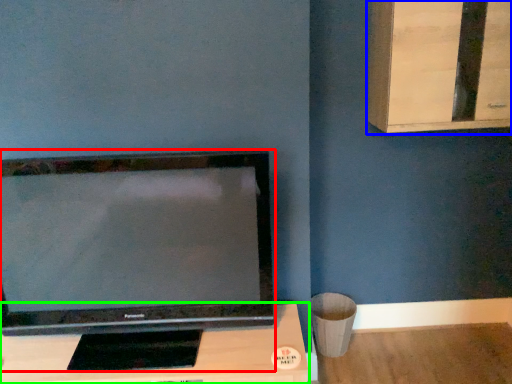
Question: Considering the real-world distances, which object is farthest from television (highlighted by a red box)? dresser (highlighted by a blue box) or furniture (highlighted by a green box)?

Choices:
 (A) dresser
 (B) furniture

Answer: (A)